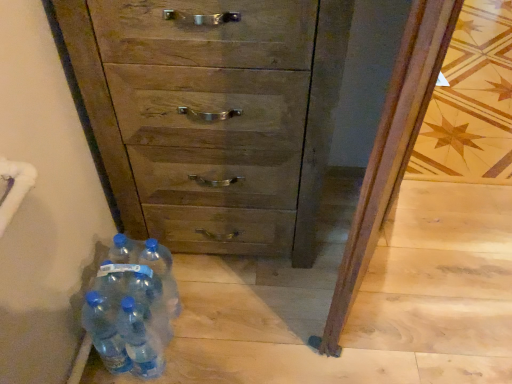
Question: Is translucent plastic water bottles at lower left, the first bottle when ordered from left to right, in front of transparent plastic bottles at lower left, the fourth bottle viewed from the left?

Choices:
 (A) no
 (B) yes

Answer: (B)

Question: Is translucent plastic water bottles at lower left, acting as the fifth bottle starting from the right, further to the viewer compared to transparent plastic bottles at lower left, the second bottle viewed from the right?

Choices:
 (A) yes
 (B) no

Answer: (B)

Question: From a real-world perspective, is translucent plastic water bottles at lower left, acting as the fifth bottle starting from the right, positioned under transparent plastic bottles at lower left, the second bottle viewed from the right, based on gravity?

Choices:
 (A) yes
 (B) no

Answer: (A)

Question: Can you confirm if translucent plastic water bottles at lower left, the first bottle when ordered from left to right, is positioned to the left of transparent plastic bottles at lower left, the fourth bottle viewed from the left?

Choices:
 (A) yes
 (B) no

Answer: (A)

Question: From the image's perspective, is translucent plastic water bottles at lower left, acting as the fifth bottle starting from the right, located beneath transparent plastic bottles at lower left, the second bottle viewed from the right?

Choices:
 (A) no
 (B) yes

Answer: (B)

Question: Can you confirm if translucent plastic water bottles at lower left, the first bottle when ordered from left to right, is bigger than transparent plastic bottles at lower left, the second bottle viewed from the right?

Choices:
 (A) no
 (B) yes

Answer: (A)

Question: From the image's perspective, is translucent plastic water bottles at lower left, acting as the fifth bottle starting from the right, under transparent plastic bottles at lower left, arranged as the third bottle when viewed from the left?

Choices:
 (A) no
 (B) yes

Answer: (A)

Question: Is transparent plastic bottles at lower left, acting as the 3th bottle starting from the right, located within translucent plastic water bottles at lower left, acting as the fifth bottle starting from the right?

Choices:
 (A) yes
 (B) no

Answer: (B)

Question: Can you confirm if translucent plastic water bottles at lower left, the first bottle when ordered from left to right, is shorter than transparent plastic bottles at lower left, arranged as the third bottle when viewed from the left?

Choices:
 (A) no
 (B) yes

Answer: (B)

Question: Is translucent plastic water bottles at lower left, the first bottle when ordered from left to right, positioned in front of transparent plastic bottles at lower left, arranged as the third bottle when viewed from the left?

Choices:
 (A) no
 (B) yes

Answer: (A)

Question: From a real-world perspective, does translucent plastic water bottles at lower left, acting as the fifth bottle starting from the right, stand above transparent plastic bottles at lower left, acting as the 3th bottle starting from the right?

Choices:
 (A) yes
 (B) no

Answer: (B)

Question: Is translucent plastic water bottles at lower left, acting as the fifth bottle starting from the right, behind transparent plastic bottles at lower left, acting as the 3th bottle starting from the right?

Choices:
 (A) no
 (B) yes

Answer: (B)

Question: Can you confirm if translucent plastic water bottles at lower left, the first bottle when ordered from left to right, is thinner than blue translucent bottle at lower left, the fifth bottle positioned from the left?

Choices:
 (A) yes
 (B) no

Answer: (A)